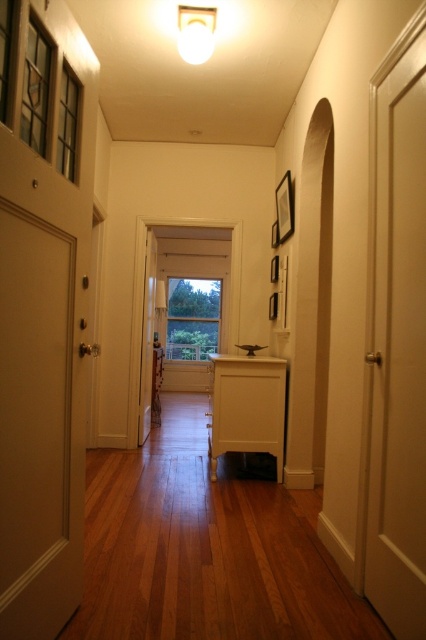
Who is more forward, (x=374, y=332) or (x=69, y=554)?

Positioned in front is point (x=69, y=554).

Can you confirm if white matte door at right is bigger than white matte door at left?

Indeed, white matte door at right has a larger size compared to white matte door at left.

What are the coordinates of `white matte door at right` in the screenshot? It's located at (397, 339).

Locate an element on the screen. This screenshot has width=426, height=640. white matte door at right is located at coordinates (397, 339).